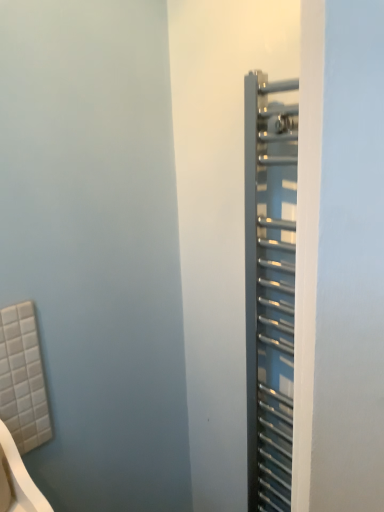
Describe the element at coordinates (17, 480) in the screenshot. I see `beige matte urinal at lower left` at that location.

Where is `beige matte urinal at lower left`? Image resolution: width=384 pixels, height=512 pixels. beige matte urinal at lower left is located at coordinates point(17,480).

Locate an element on the screen. beige matte urinal at lower left is located at coordinates (17, 480).